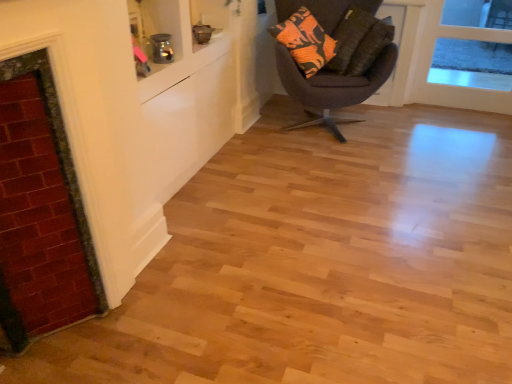
Question: Is orange printed fabric pillow at upper right, marked as the 1th pillow in a front-to-back arrangement, to the left or to the right of transparent glass door at upper right in the image?

Choices:
 (A) right
 (B) left

Answer: (B)

Question: Considering the positions of point (385, 33) and point (429, 57), is point (385, 33) closer or farther from the camera than point (429, 57)?

Choices:
 (A) farther
 (B) closer

Answer: (B)

Question: Which is nearer to the orange printed fabric pillow at upper right, marked as the 1th pillow in a front-to-back arrangement?

Choices:
 (A) transparent glass door at upper right
 (B) dark brown fabric chair at center
 (C) red brick fireplace at left
 (D) orange patterned pillow at upper right, which is counted as the second pillow, starting from the front

Answer: (D)

Question: Which is nearer to the dark brown fabric chair at center?

Choices:
 (A) orange patterned pillow at upper right, which is counted as the second pillow, starting from the front
 (B) red brick fireplace at left
 (C) orange printed fabric pillow at upper right, marked as the 1th pillow in a front-to-back arrangement
 (D) transparent glass door at upper right

Answer: (C)